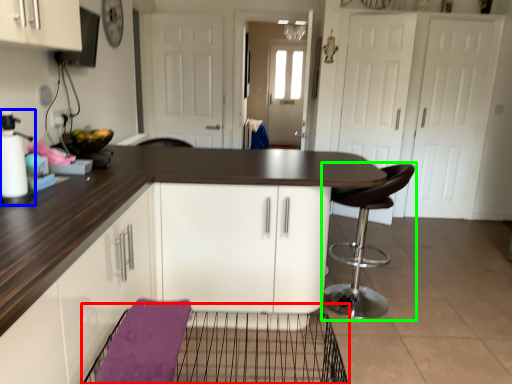
Question: Estimate the real-world distances between objects in this image. Which object is closer to cage (highlighted by a red box), appliance (highlighted by a blue box) or chair (highlighted by a green box)?

Choices:
 (A) appliance
 (B) chair

Answer: (B)